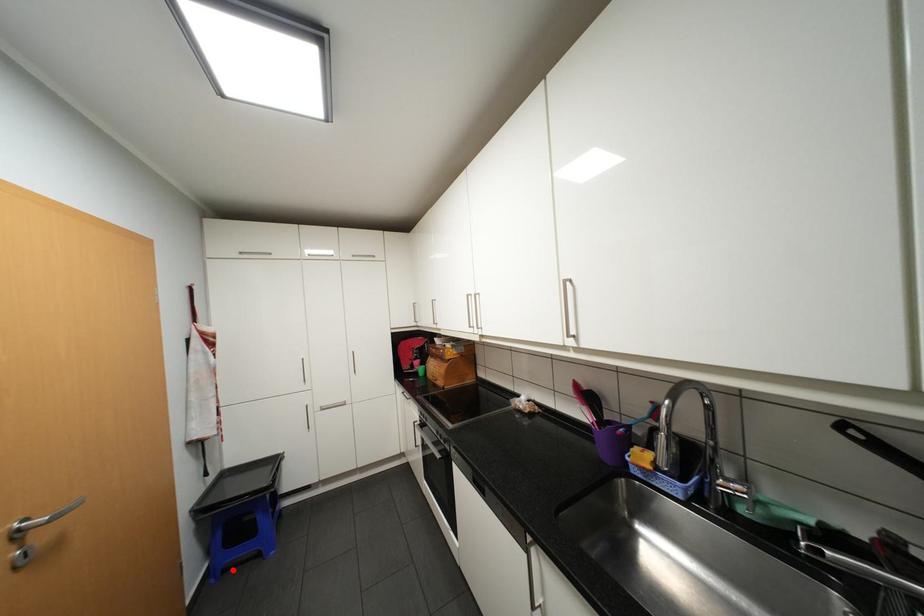
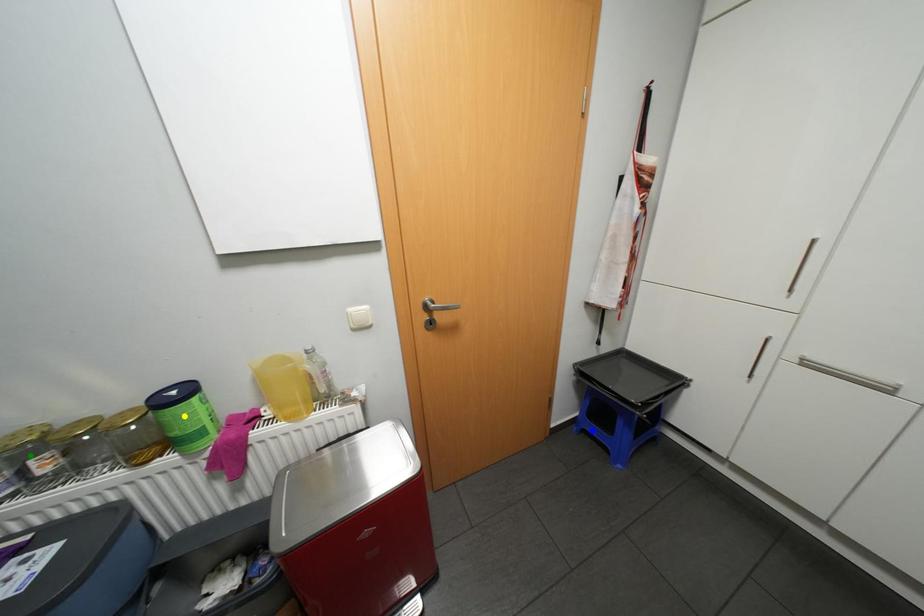
Question: I am providing you with two images of the same scene from different viewpoints. A red point is marked on the first image. You are given multiple points on the second image. Can you choose the point in image 2 that corresponds to the point in image 1?

Choices:
 (A) green point
 (B) blue point
 (C) yellow point

Answer: (B)